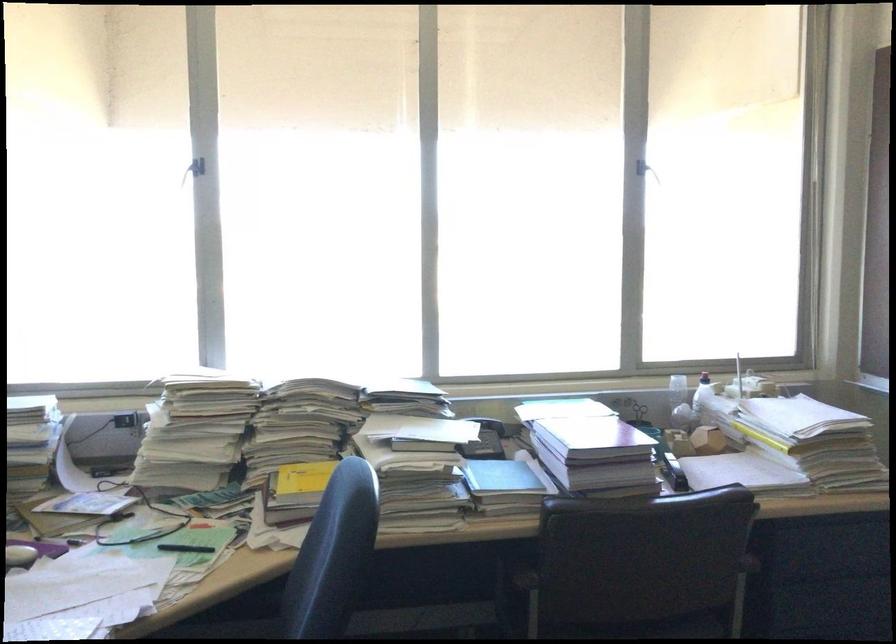
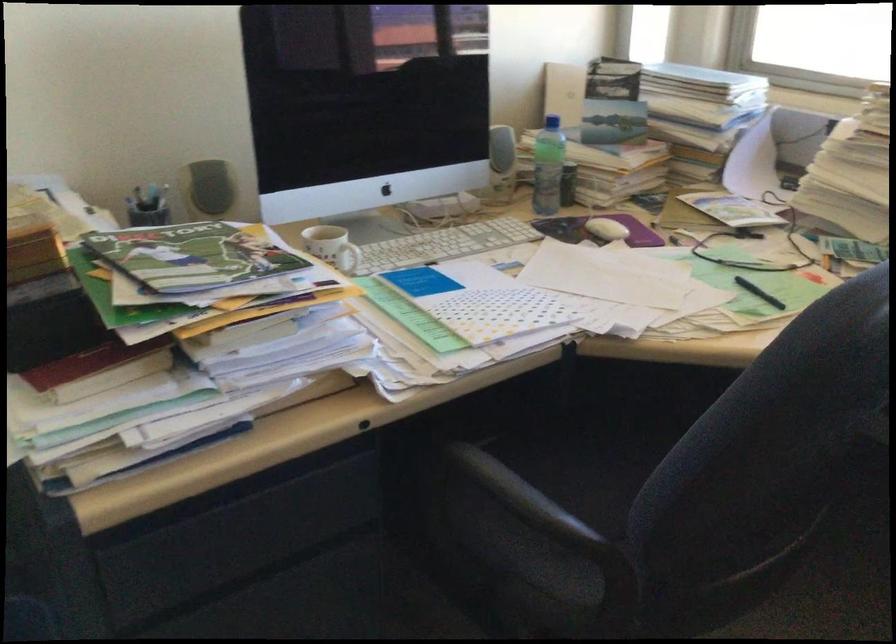
Consider the image. How did the camera likely rotate?

The camera rotated toward left-down.